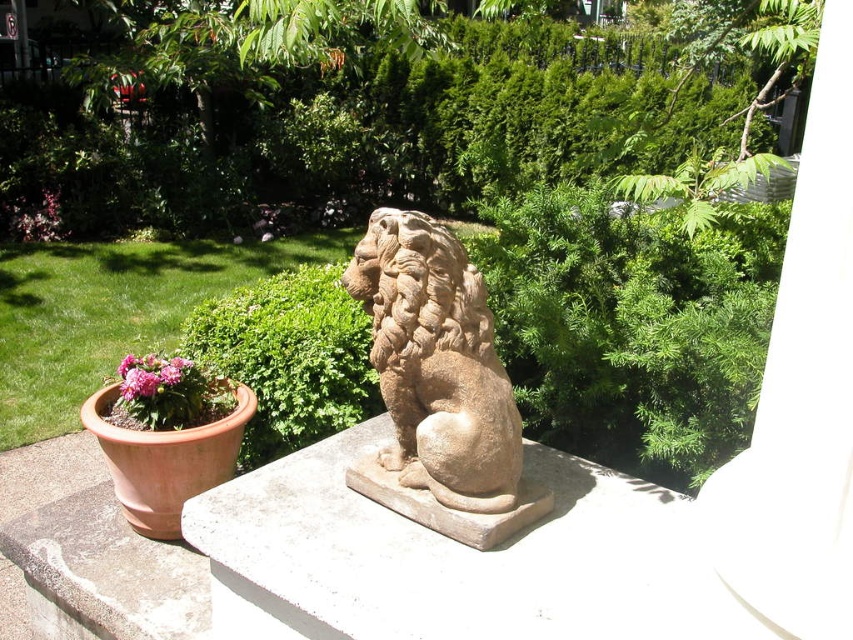
Does point (221, 337) come closer to viewer compared to point (148, 358)?

No.

Who is positioned more to the right, green leafy bush at center or pink matte flower at lower left?

From the viewer's perspective, green leafy bush at center appears more on the right side.

Who is more forward, (346,396) or (151,362)?

Point (151,362)

Find the location of a particular element. The image size is (853, 640). green leafy bush at center is located at coordinates (288, 356).

Is point (462, 342) positioned in front of point (216, 340)?

Yes, it is in front of point (216, 340).

Does brown stone lion at center lie in front of green leafy bush at center?

Yes, brown stone lion at center is closer to the viewer.

Which is behind, point (496, 483) or point (236, 362)?

Positioned behind is point (236, 362).

This screenshot has width=853, height=640. In order to click on brown stone lion at center in this screenshot , I will do `click(438, 387)`.

In the scene shown: Between brown stone lion at center and pink matte flower at lower left, which one is positioned higher?

brown stone lion at center is above.

Between brown stone lion at center and pink matte flower at lower left, which one appears on the right side from the viewer's perspective?

Positioned to the right is brown stone lion at center.

Describe the element at coordinates (438, 387) in the screenshot. I see `brown stone lion at center` at that location.

What are the coordinates of `brown stone lion at center` in the screenshot? It's located at (438, 387).